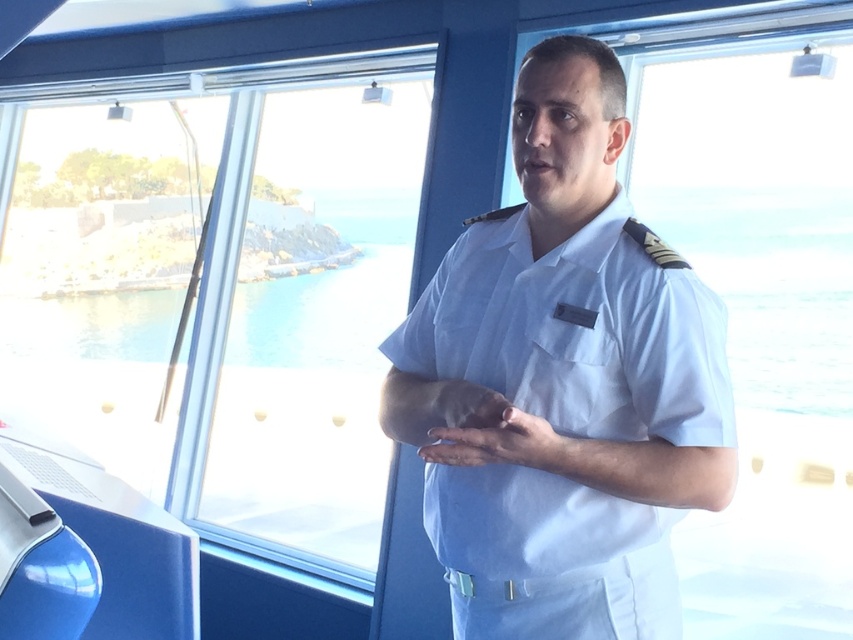
You are a passenger on a ship and want to see the ocean view through the transparent glass window at center. However, there is a white cotton shirt at center blocking your view. Can you see the ocean through the window?

The white cotton shirt at center is located below the transparent glass window at center, so you can still see the ocean through the transparent glass window at center as the shirt is below it and not covering the window.

You are a sailor on the ship and need to check the weather outside. You are currently facing the transparent glass window at center. Which direction should you turn to see the white cotton shirt at center?

The white cotton shirt at center is to the right of the transparent glass window at center, so you should turn to your right to see the white cotton shirt at center.

You are an observer looking at the scene. There is a point marked at coordinates (x=577, y=333). What object is located at that point?

The point at coordinates (x=577, y=333) marks the white cotton shirt at center.